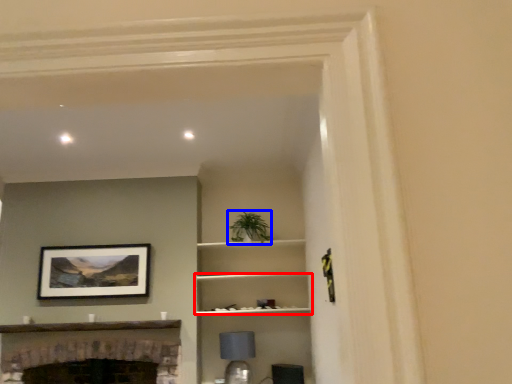
Question: Which of the following is the closest to the observer, shelf (highlighted by a red box) or plant (highlighted by a blue box)?

Choices:
 (A) shelf
 (B) plant

Answer: (A)